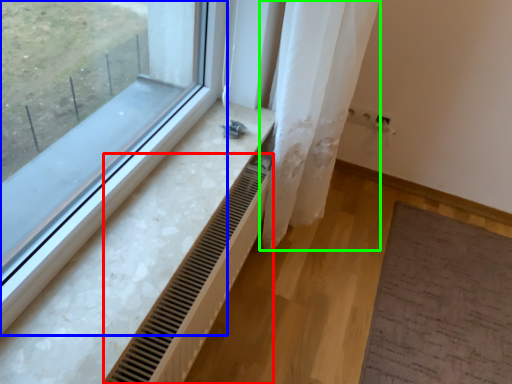
Question: Based on their relative distances, which object is nearer to radiator (highlighted by a red box)? Choose from window (highlighted by a blue box) and shower curtain (highlighted by a green box).

Choices:
 (A) window
 (B) shower curtain

Answer: (A)